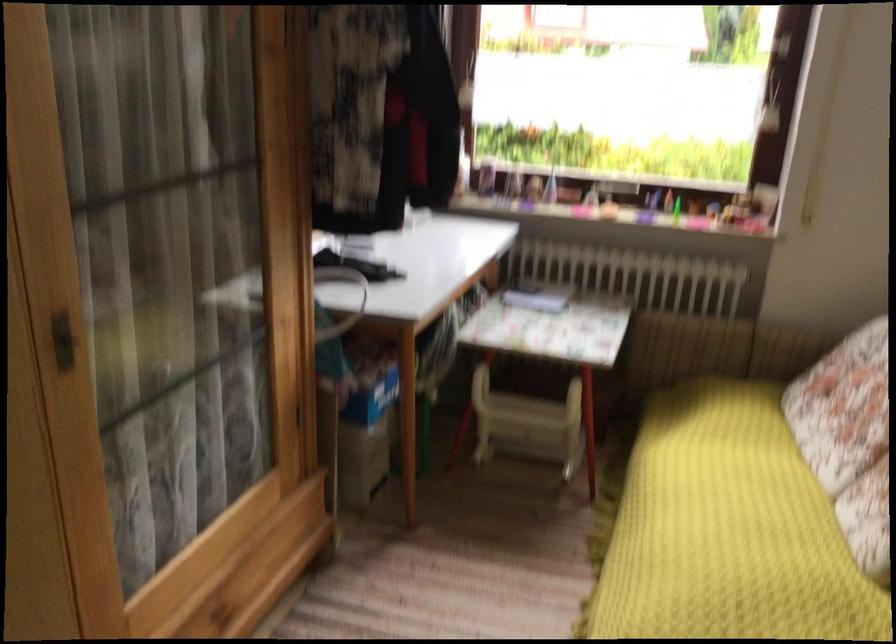
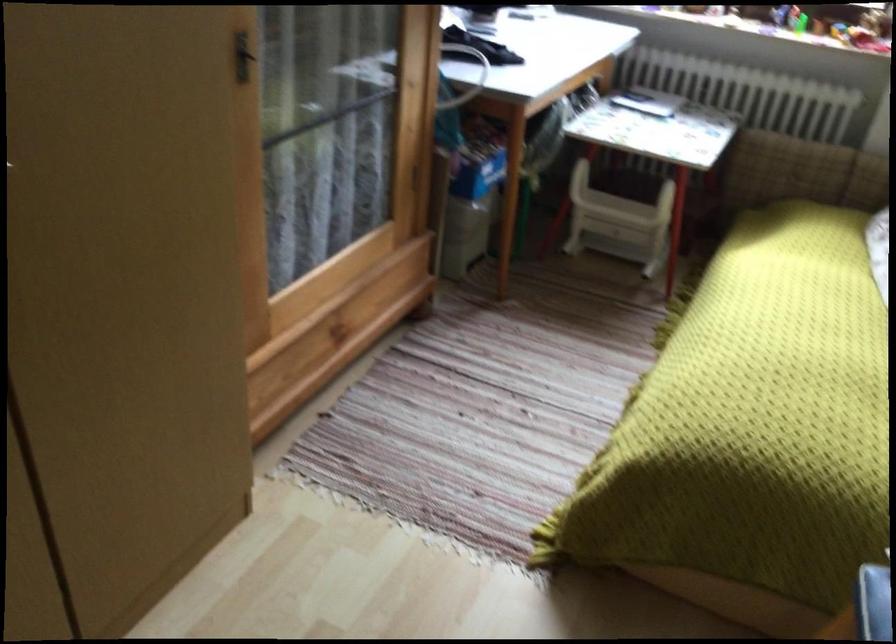
Question: What movement of the cameraman would produce the second image?

Choices:
 (A) Left
 (B) Right
 (C) Forward
 (D) Backward

Answer: (D)